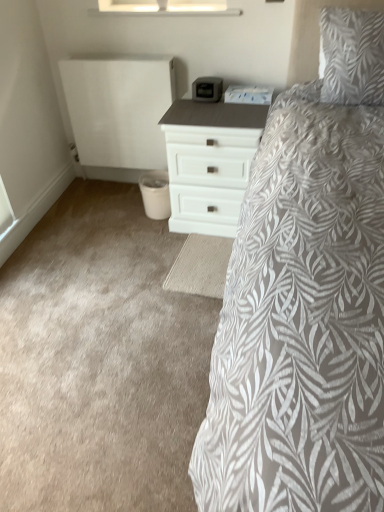
Where is `vacant space positioned to the left of white matte chest of drawers at center`? vacant space positioned to the left of white matte chest of drawers at center is located at coordinates (109, 226).